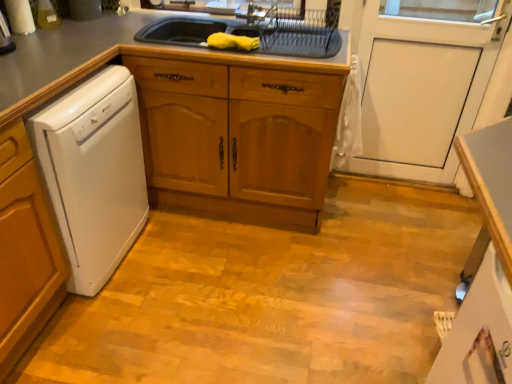
The image size is (512, 384). What are the coordinates of `vacant space situated on the left part of white glossy counter at lower right` in the screenshot? It's located at (286, 328).